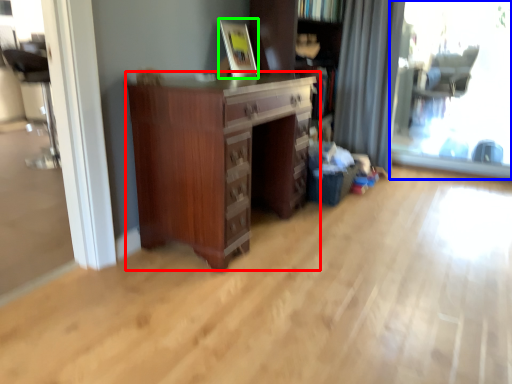
Question: Considering the real-world distances, which object is farthest from chest of drawers (highlighted by a red box)? window screen (highlighted by a blue box) or picture frame (highlighted by a green box)?

Choices:
 (A) window screen
 (B) picture frame

Answer: (A)